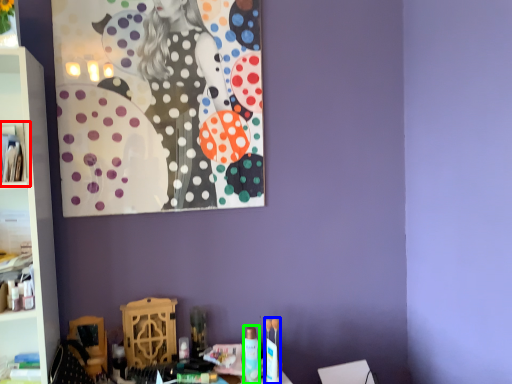
Question: Which object is the closest to the cabinet (highlighted by a red box)? Choose among these: toy (highlighted by a blue box) or toiletry (highlighted by a green box).

Choices:
 (A) toy
 (B) toiletry

Answer: (B)